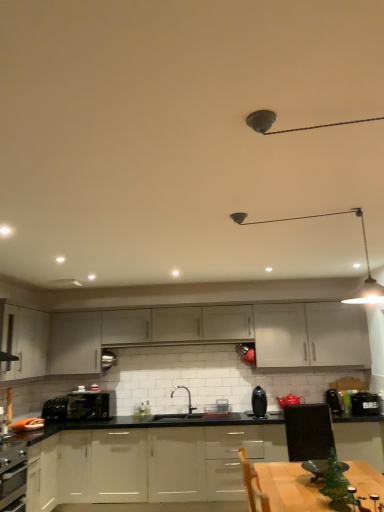
Question: Does black plastic toaster at lower left, marked as the 1th appliance in a back-to-front arrangement, have a smaller size compared to matte gray cabinet at center, which is the 2th cabinetry from bottom to top?

Choices:
 (A) yes
 (B) no

Answer: (A)

Question: From a real-world perspective, is black plastic toaster at lower left, marked as the 1th appliance in a back-to-front arrangement, located higher than matte gray cabinet at center, the 3th cabinetry when ordered from top to bottom?

Choices:
 (A) yes
 (B) no

Answer: (B)

Question: Is black plastic toaster at lower left, which is counted as the second appliance, starting from the front, wider than matte gray cabinet at center, the 3th cabinetry when ordered from top to bottom?

Choices:
 (A) yes
 (B) no

Answer: (B)

Question: Is black plastic toaster at lower left, which ranks as the second appliance in right-to-left order, behind matte gray cabinet at center, the 3th cabinetry when ordered from top to bottom?

Choices:
 (A) no
 (B) yes

Answer: (A)

Question: Is the position of black plastic toaster at lower left, which is counted as the second appliance, starting from the front, less distant than that of matte gray cabinet at center, the 3th cabinetry when ordered from top to bottom?

Choices:
 (A) yes
 (B) no

Answer: (A)

Question: Is black plastic toaster at lower left, which is counted as the second appliance, starting from the front, bigger or smaller than metallic silver kettle at right, which appears as the first appliance when viewed from the front?

Choices:
 (A) big
 (B) small

Answer: (A)

Question: Considering the positions of black plastic toaster at lower left, marked as the 1th appliance in a back-to-front arrangement, and metallic silver kettle at right, the second appliance when ordered from back to front, in the image, is black plastic toaster at lower left, marked as the 1th appliance in a back-to-front arrangement, wider or thinner than metallic silver kettle at right, the second appliance when ordered from back to front,?

Choices:
 (A) wide
 (B) thin

Answer: (A)

Question: In the image, is black plastic toaster at lower left, which ranks as the second appliance in right-to-left order, positioned in front of or behind metallic silver kettle at right, which appears as the first appliance when viewed from the front?

Choices:
 (A) front
 (B) behind

Answer: (B)

Question: Is black plastic toaster at lower left, which ranks as the second appliance in right-to-left order, situated inside metallic silver kettle at right, arranged as the second appliance when viewed from the left, or outside?

Choices:
 (A) outside
 (B) inside

Answer: (A)

Question: From a real-world perspective, is matte gray cabinet at center, the 3th cabinetry when ordered from top to bottom, above or below white glossy cabinets at center, marked as the first cabinetry in a bottom-to-top arrangement?

Choices:
 (A) above
 (B) below

Answer: (A)

Question: From the image's perspective, is matte gray cabinet at center, the 3th cabinetry when ordered from top to bottom, located above or below white glossy cabinets at center, which is the fourth cabinetry from top to bottom?

Choices:
 (A) above
 (B) below

Answer: (A)

Question: In terms of width, does matte gray cabinet at center, which is the 2th cabinetry from bottom to top, look wider or thinner when compared to white glossy cabinets at center, which is the fourth cabinetry from top to bottom?

Choices:
 (A) thin
 (B) wide

Answer: (A)

Question: Considering their positions, is matte gray cabinet at center, which is the 2th cabinetry from bottom to top, located in front of or behind white glossy cabinets at center, marked as the first cabinetry in a bottom-to-top arrangement?

Choices:
 (A) front
 (B) behind

Answer: (B)

Question: Considering their positions, is metallic silver toaster at center, which is the 2th kitchen appliance in front-to-back order, located in front of or behind white matte cabinet at center, the third cabinetry in the bottom-to-top sequence?

Choices:
 (A) front
 (B) behind

Answer: (B)

Question: Is metallic silver toaster at center, which ranks as the first kitchen appliance in back-to-front order, wider or thinner than white matte cabinet at center, the third cabinetry in the bottom-to-top sequence?

Choices:
 (A) thin
 (B) wide

Answer: (B)